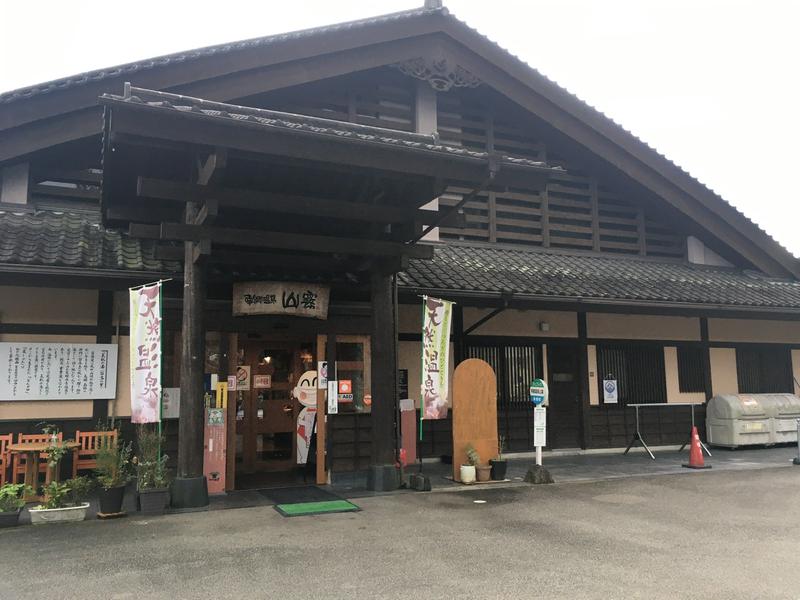
The image size is (800, 600). Find the location of `doors`. doors is located at coordinates (268, 405).